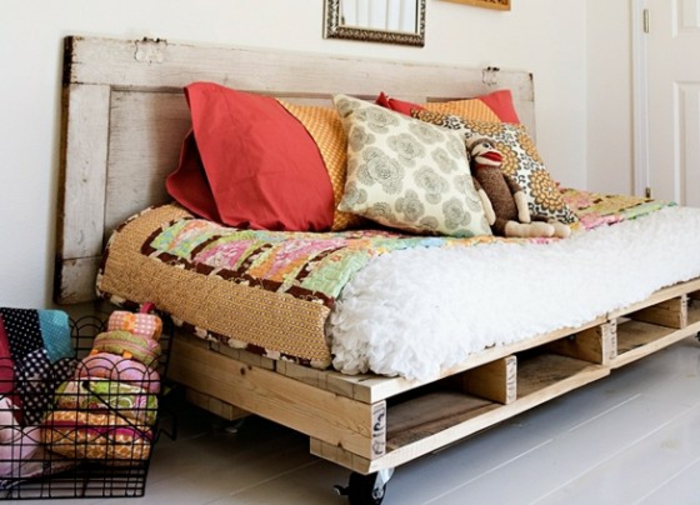
You are a GUI agent. You are given a task and a screenshot of the screen. Output one action in this format:
    pyautogui.click(x=<x>, y=<y>)
    Task: Click on the blue red and black pillow
    
    Given the screenshot: What is the action you would take?
    pyautogui.click(x=22, y=335)